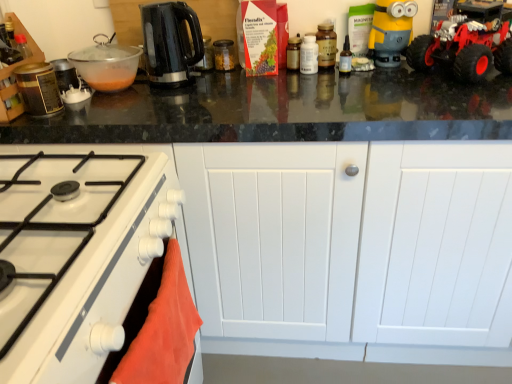
Image resolution: width=512 pixels, height=384 pixels. I want to click on vacant point to the right of metallic canister at left, which is the first kitchen appliance in left-to-right order, so click(x=97, y=114).